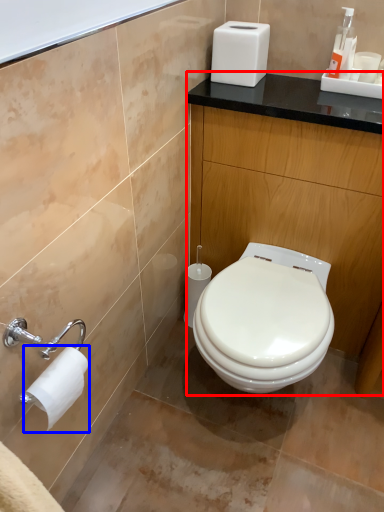
Question: Which of the following is the closest to the observer, counter (highlighted by a red box) or toilet paper (highlighted by a blue box)?

Choices:
 (A) counter
 (B) toilet paper

Answer: (B)